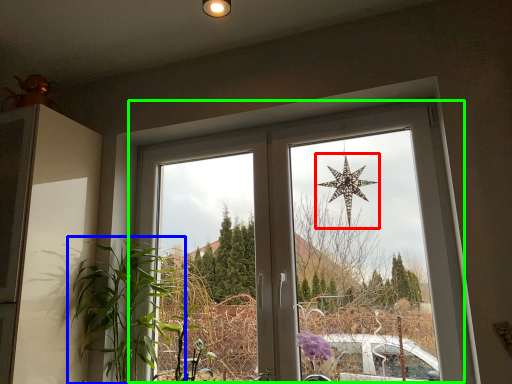
Question: Which object is positioned closest to star (highlighted by a red box)? Select from houseplant (highlighted by a blue box) and window (highlighted by a green box).

Choices:
 (A) houseplant
 (B) window

Answer: (B)